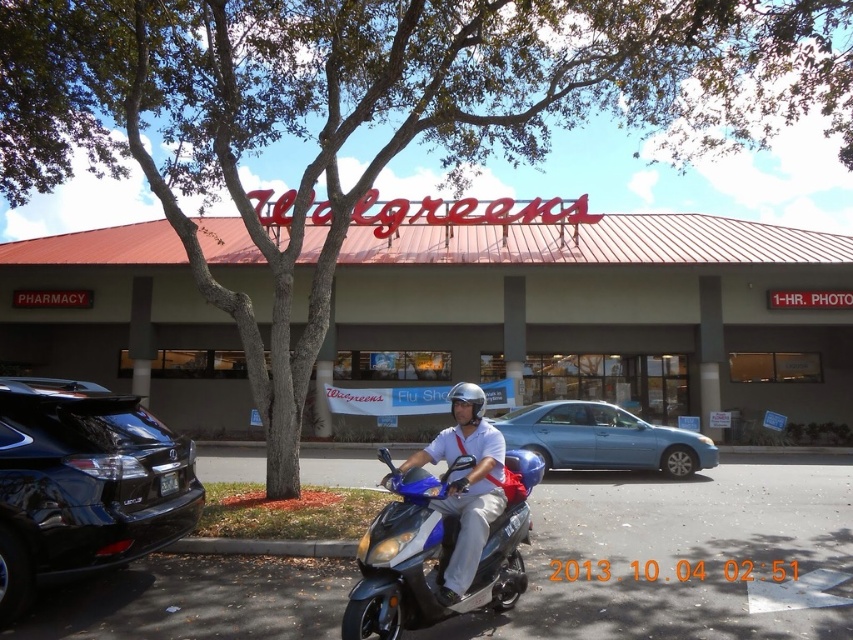
You are a delivery rider who needs to secure your blue matte helmet at center onto the metallic blue scooter at center. The scooter has a standard helmet rack. Is the helmet likely to fit securely on the rack?

The metallic blue scooter at center is larger in size than blue matte helmet at center, so the helmet should fit securely on the standard rack since it is smaller than the scooter.

You are standing at the entrance of the Walgreens store and want to park your matte blue scooter at center. Based on the image, where should you place it to align with the center point coordinates provided?

The matte blue scooter at center should be placed at the coordinates [467,483] as specified in the description.

You are a delivery rider who just arrived at the Walgreens store. You need to park your scooter and helmet properly. According to the image, where should you place the matte blue scooter at center and the white matte helmet at center so that they are both visible from the store entrance?

The matte blue scooter at center should be placed to the left of the white matte helmet at center so that both are visible from the store entrance.